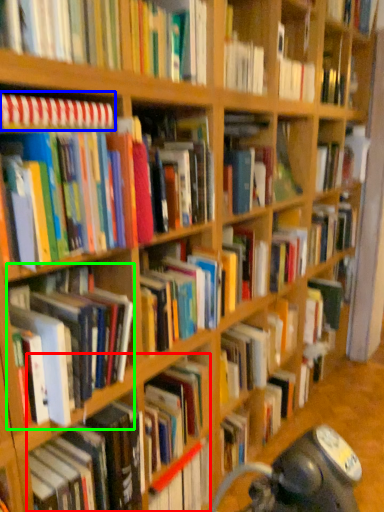
Question: Based on their relative distances, which object is farther from book (highlighted by a red box)? Choose from book (highlighted by a blue box) and book (highlighted by a green box).

Choices:
 (A) book
 (B) book

Answer: (A)